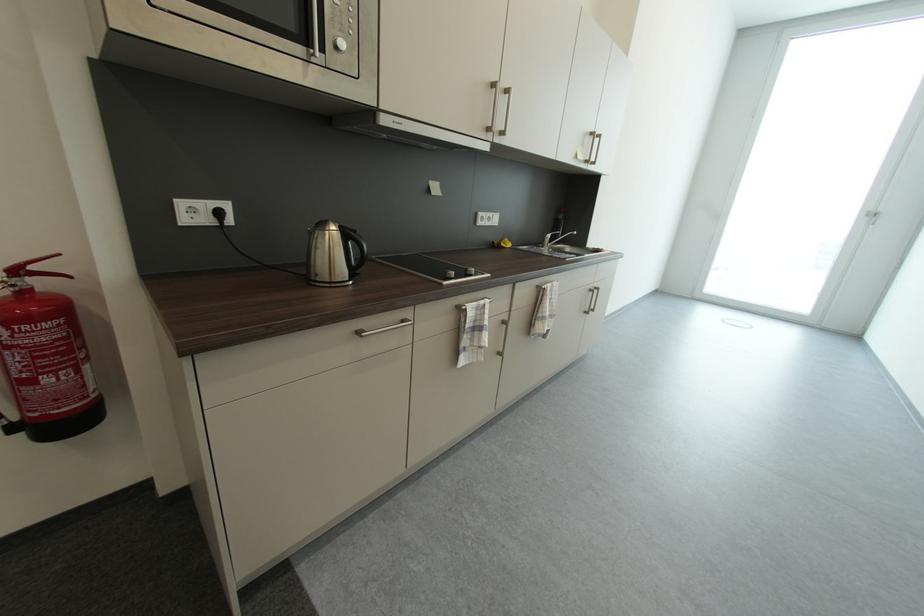
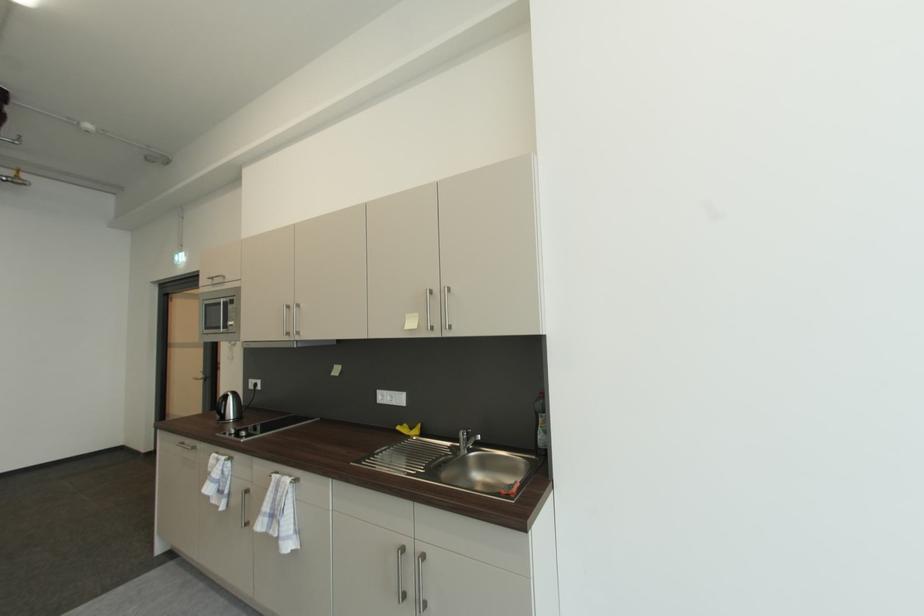
Find the pixel in the second image that matches point 552,290 in the first image.

(277, 477)